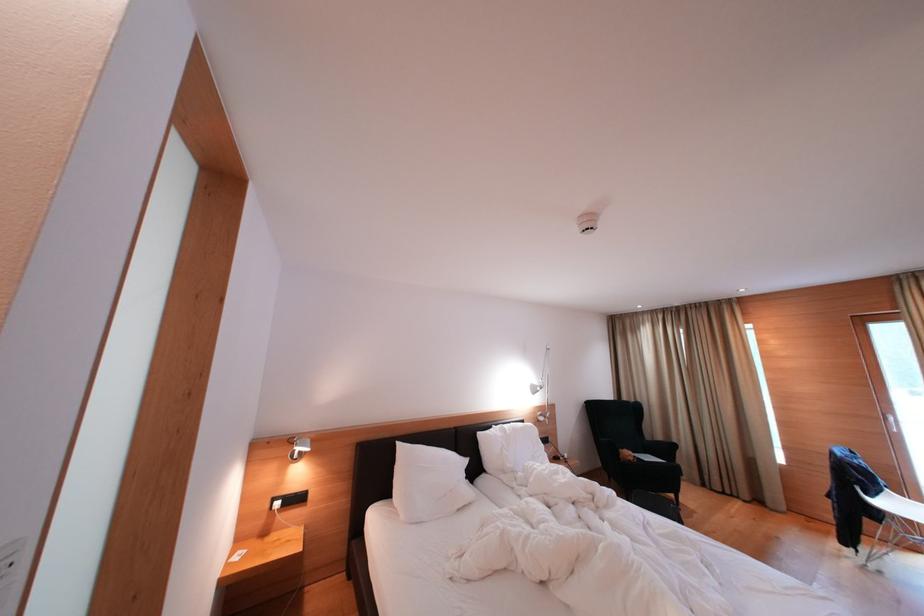
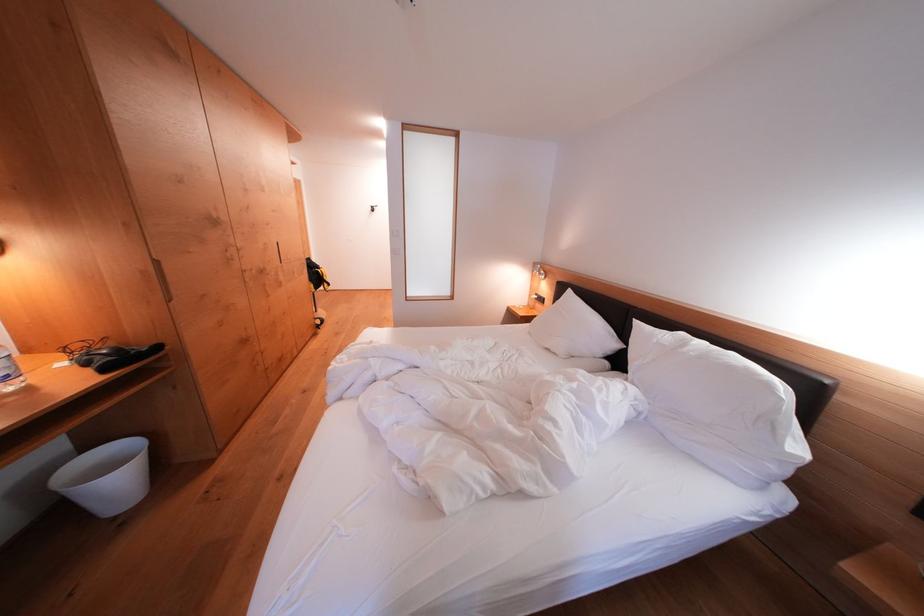
Locate, in the second image, the point that corresponds to the point at 487,438 in the first image.

(642, 326)